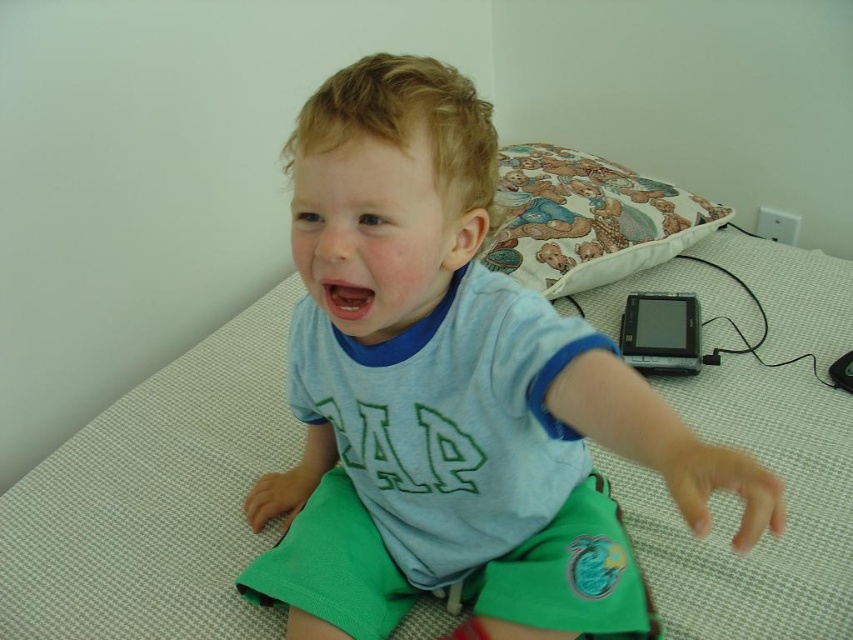
Based on the scene description, where is the light blue cotton shirt at center in relation to the fluffy fabric pillow at upper right?

The light blue cotton shirt at center is located below the fluffy fabric pillow at upper right.

You are a tailor who needs to determine if the light blue cotton shirt at center can fit into a storage box designed for items smaller than the fluffy fabric pillow at upper right. Based on the scene, can the shirt fit?

The light blue cotton shirt at center has a width less than the fluffy fabric pillow at upper right, so it can fit into the storage box designed for items smaller than the pillow.